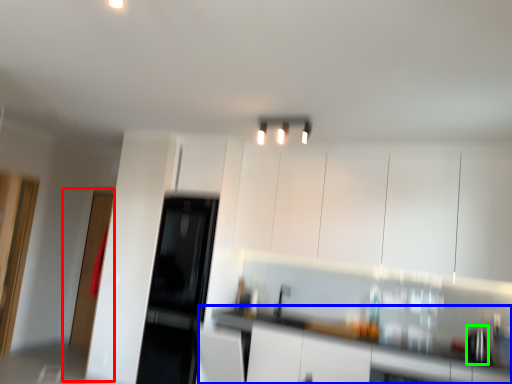
Question: Which object is positioned closest to glass door (highlighted by a red box)? Select from counter top (highlighted by a blue box) and appliance (highlighted by a green box).

Choices:
 (A) counter top
 (B) appliance

Answer: (A)